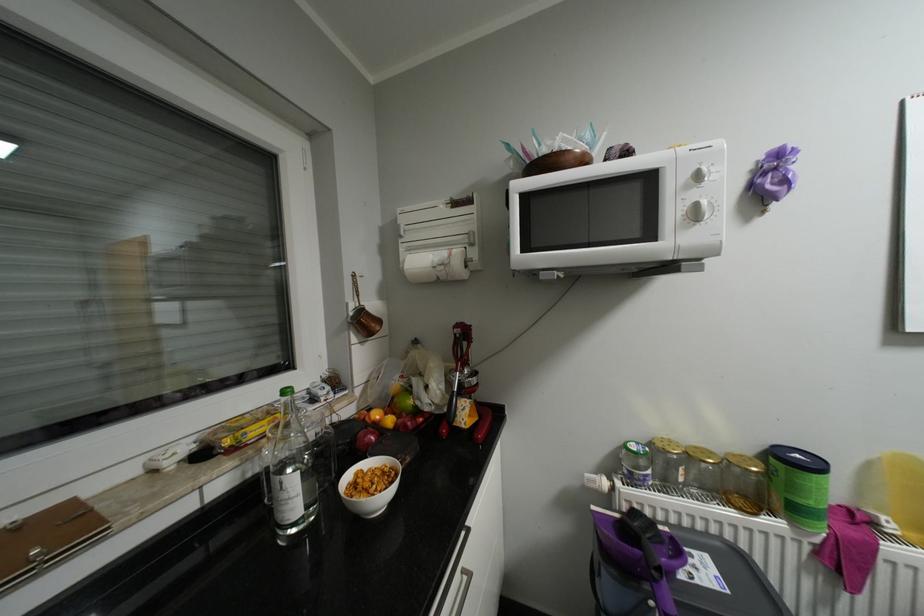
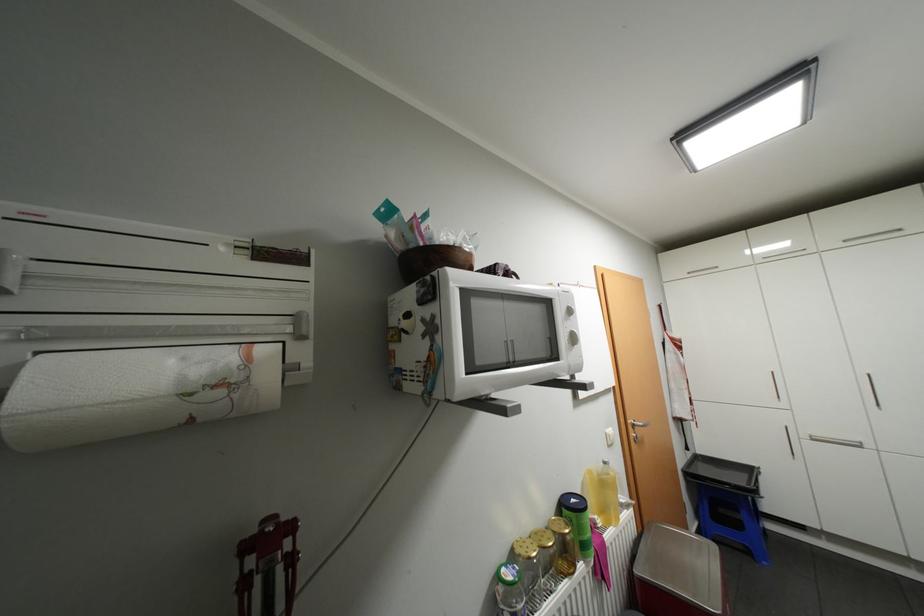
In the second image, find the point that corresponds to (800,485) in the first image.

(589, 528)